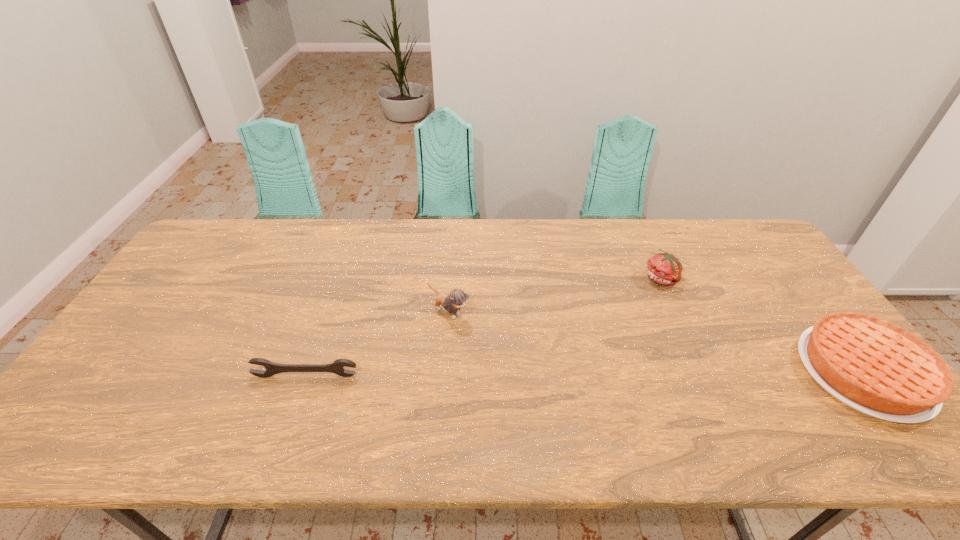
Identify which object is the third nearest to the leftmost object. Please provide its 2D coordinates. Your answer should be formatted as a tuple, i.e. [(x, y)], where the tuple contains the x and y coordinates of a point satisfying the conditions above.

[(875, 367)]